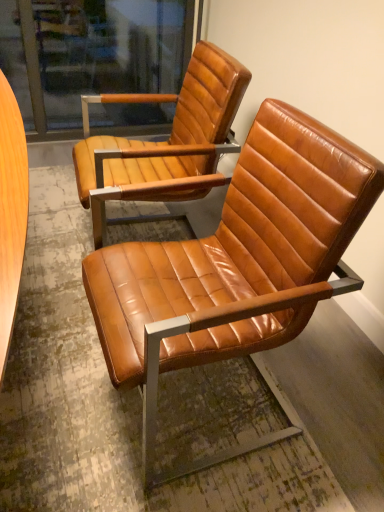
Question: Visually, is cognac leather chair at center, the 2th chair viewed from the back, positioned to the left or to the right of cognac leather chair at center, positioned as the 2th chair in front-to-back order?

Choices:
 (A) right
 (B) left

Answer: (A)

Question: Considering the positions of cognac leather chair at center, which appears as the 1th chair when viewed from the front, and cognac leather chair at center, which appears as the first chair when viewed from the back, in the image, is cognac leather chair at center, which appears as the 1th chair when viewed from the front, wider or thinner than cognac leather chair at center, which appears as the first chair when viewed from the back,?

Choices:
 (A) thin
 (B) wide

Answer: (B)

Question: From a real-world perspective, is cognac leather chair at center, which appears as the 1th chair when viewed from the front, above or below cognac leather chair at center, which appears as the first chair when viewed from the back?

Choices:
 (A) below
 (B) above

Answer: (B)

Question: In terms of height, does cognac leather chair at center, positioned as the 2th chair in front-to-back order, look taller or shorter compared to cognac leather chair at center, which appears as the 1th chair when viewed from the front?

Choices:
 (A) short
 (B) tall

Answer: (A)

Question: Choose the correct answer: Is cognac leather chair at center, positioned as the 2th chair in front-to-back order, inside cognac leather chair at center, the 2th chair viewed from the back, or outside it?

Choices:
 (A) inside
 (B) outside

Answer: (B)

Question: Is cognac leather chair at center, which appears as the first chair when viewed from the back, wider or thinner than cognac leather chair at center, which appears as the 1th chair when viewed from the front?

Choices:
 (A) thin
 (B) wide

Answer: (A)

Question: From a real-world perspective, is cognac leather chair at center, positioned as the 2th chair in front-to-back order, positioned above or below cognac leather chair at center, the 2th chair viewed from the back?

Choices:
 (A) below
 (B) above

Answer: (A)